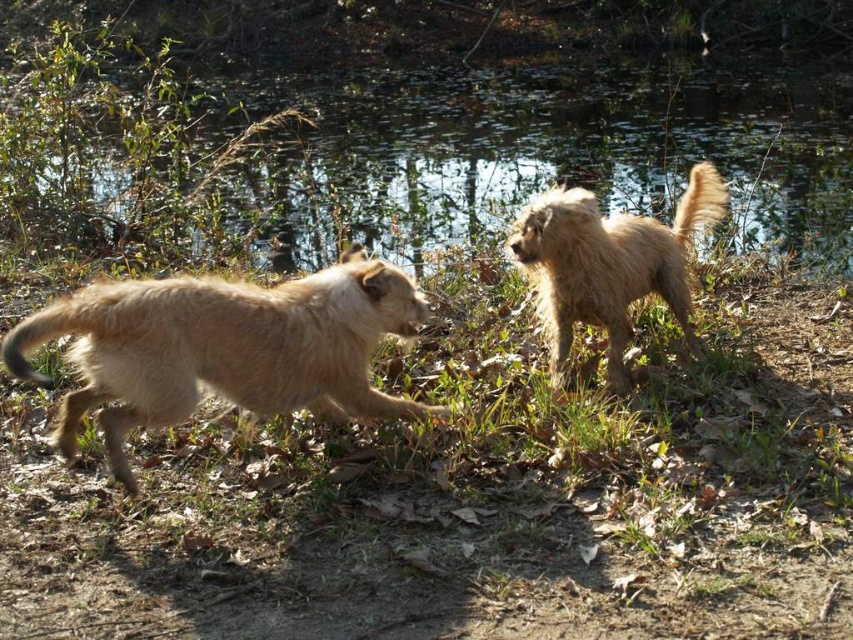
Question: Can you confirm if green grass at upper center is wider than fuzzy beige dog at left?

Choices:
 (A) yes
 (B) no

Answer: (A)

Question: Which point is farther from the camera taking this photo?

Choices:
 (A) (518, 618)
 (B) (274, 385)

Answer: (B)

Question: Is green grass at upper center above fuzzy beige dog at left?

Choices:
 (A) no
 (B) yes

Answer: (B)

Question: From the image, what is the correct spatial relationship of green grass at center in relation to fuzzy beige dog at left?

Choices:
 (A) left
 (B) right

Answer: (B)

Question: Which point is closer to the camera?

Choices:
 (A) (654, 289)
 (B) (24, 545)
 (C) (363, 376)

Answer: (B)

Question: Which object appears farthest from the camera in this image?

Choices:
 (A) green grass at center
 (B) green grass at upper center

Answer: (B)